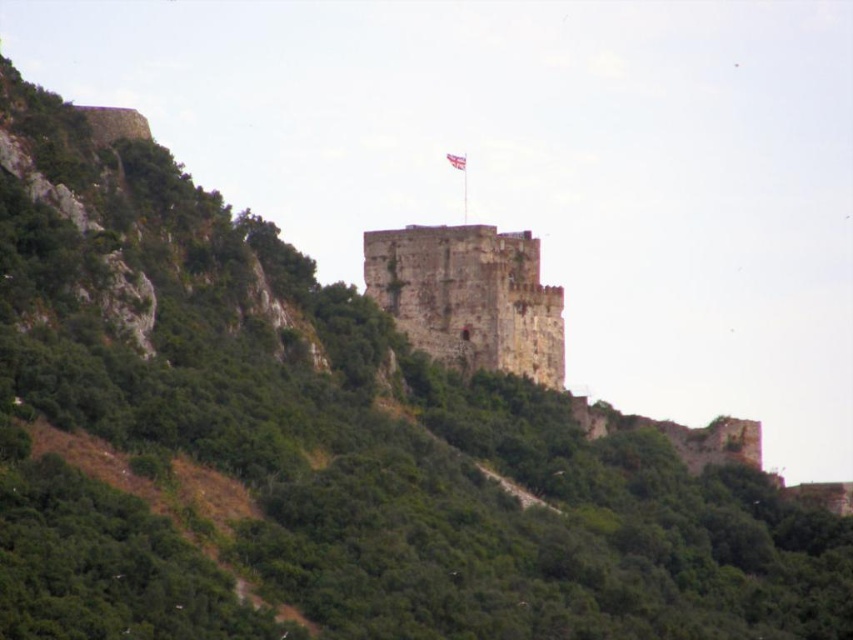
Consider the image. You are a drone operator tasked with capturing aerial footage of the historic site. Your drone has a maximum flight range of 500 feet. If you are currently positioned at the camera location, can your drone safely reach the rusty stone tower at center without exceeding its range limit?

The distance between the rusty stone tower at center and the camera is 556.20 feet, which exceeds the drone operator drone maximum flight range of 500 feet. Therefore, the drone cannot safely reach the rusty stone tower at center without exceeding its range limit.

You are a medieval knight standing at the base of the rusty stone tower at center. You see the white fabric flag at upper center flying above you. Can you determine if the flag is above or below the tower?

The white fabric flag at upper center is above the rusty stone tower at center because the description states that the rusty stone tower at center is below the white fabric flag at upper center.

You are a medieval knight standing at the base of the hill. You need to climb the hill to reach the rusty stone tower at center. However, there is a white fabric flag at upper center that might block your path. Based on their sizes, can you estimate whether the flag is large enough to cover the entire tower?

The rusty stone tower at center has a larger size compared to the white fabric flag at upper center. Therefore, the flag is not large enough to cover the entire tower.